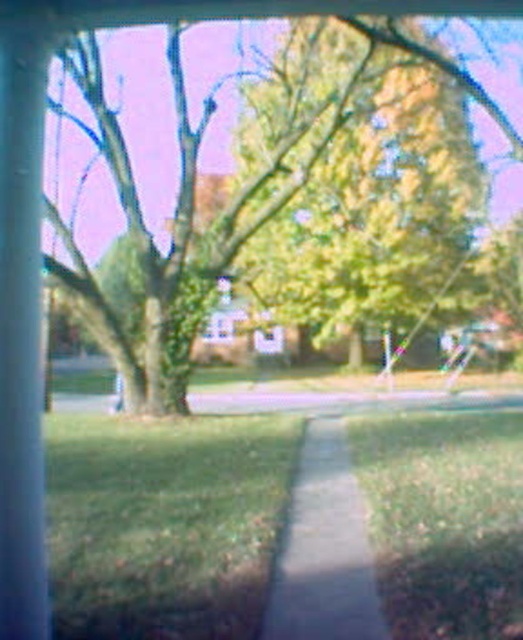
Can you confirm if green grass at lower left is bigger than concrete sidewalk at center?

Correct, green grass at lower left is larger in size than concrete sidewalk at center.

From the picture: Can you confirm if green grass at lower left is positioned to the left of concrete sidewalk at center?

Yes, green grass at lower left is to the left of concrete sidewalk at center.

Is point (242, 637) closer to camera compared to point (323, 420)?

Yes.

What are the coordinates of `green grass at lower left` in the screenshot? It's located at (164, 524).

Who is positioned more to the left, green leafy tree at upper left or concrete sidewalk at center?

From the viewer's perspective, green leafy tree at upper left appears more on the left side.

Can you confirm if green leafy tree at upper left is smaller than concrete sidewalk at center?

No, green leafy tree at upper left is not smaller than concrete sidewalk at center.

The width and height of the screenshot is (523, 640). What do you see at coordinates (236, 188) in the screenshot? I see `green leafy tree at upper left` at bounding box center [236, 188].

Where is `green leafy tree at upper left`? The height and width of the screenshot is (640, 523). green leafy tree at upper left is located at coordinates (236, 188).

Can you confirm if green grass at lower center is positioned to the right of concrete sidewalk at center?

Indeed, green grass at lower center is positioned on the right side of concrete sidewalk at center.

Where is `green grass at lower center`? The height and width of the screenshot is (640, 523). green grass at lower center is located at coordinates (445, 520).

Is point (394, 484) farther from camera compared to point (339, 614)?

That is True.

The height and width of the screenshot is (640, 523). What are the coordinates of `green grass at lower center` in the screenshot? It's located at (445, 520).